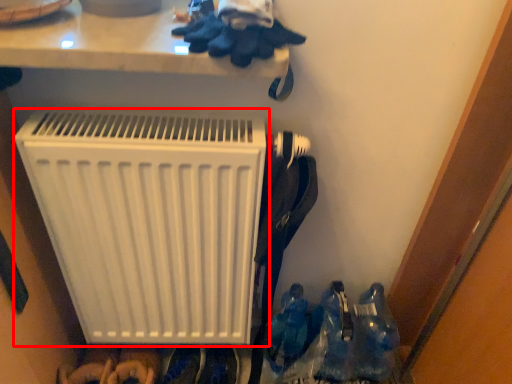
Question: From the image, what is the correct spatial relationship of home appliance (annotated by the red box) in relation to footwear?

Choices:
 (A) left
 (B) right

Answer: (A)